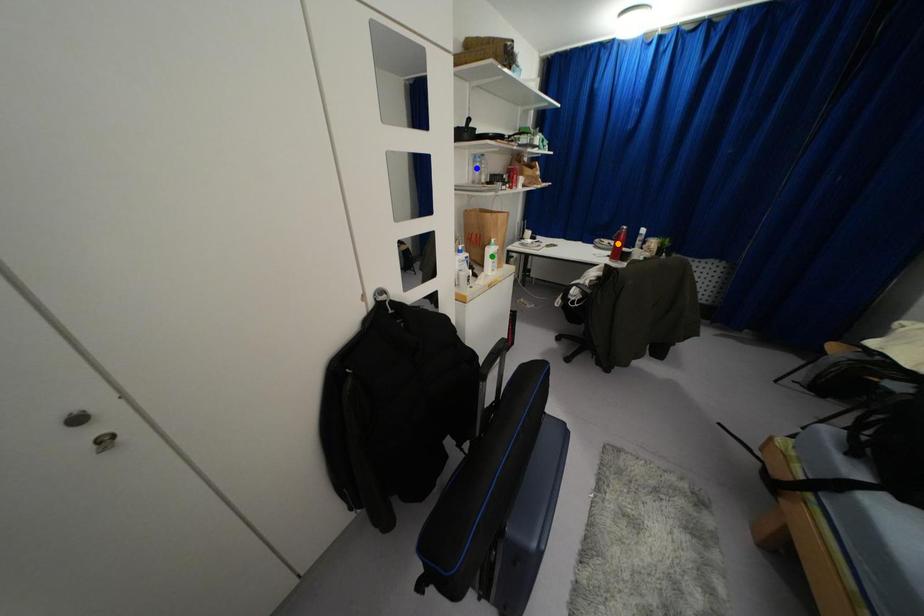
Order these from nearest to farthest:
1. orange point
2. green point
3. blue point

green point < blue point < orange point